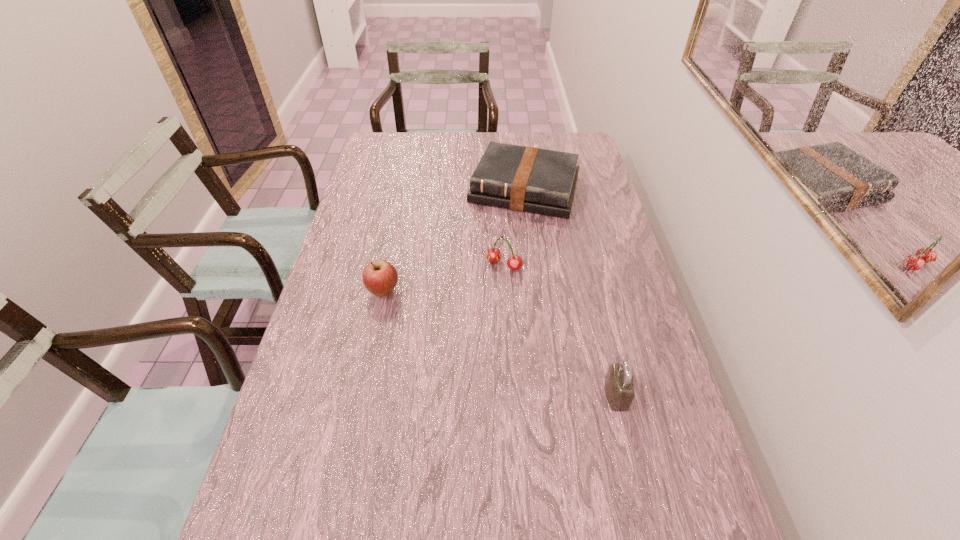
The height and width of the screenshot is (540, 960). Identify the location of free space at the near edge. (467, 530).

The width and height of the screenshot is (960, 540). Find the location of `blank space at the left edge of the desktop`. blank space at the left edge of the desktop is located at coordinates (285, 471).

Identify the location of vacant area at the right edge of the desktop. The width and height of the screenshot is (960, 540). (677, 406).

Locate an element on the screen. The height and width of the screenshot is (540, 960). vacant space at the near left corner is located at coordinates (297, 520).

I want to click on free spot at the far right corner of the desktop, so click(585, 135).

Identify the location of vacant space at the near right corner of the desktop. This screenshot has height=540, width=960. (719, 532).

Image resolution: width=960 pixels, height=540 pixels. Identify the location of vacant space in between the nearest object and the farthest object. (570, 292).

What are the coordinates of `free space between the shortest object and the padlock` in the screenshot? It's located at (570, 292).

Locate an element on the screen. This screenshot has height=540, width=960. empty space that is in between the nearest object and the leftmost object is located at coordinates (500, 343).

This screenshot has height=540, width=960. I want to click on blank region between the farthest object and the padlock, so click(570, 292).